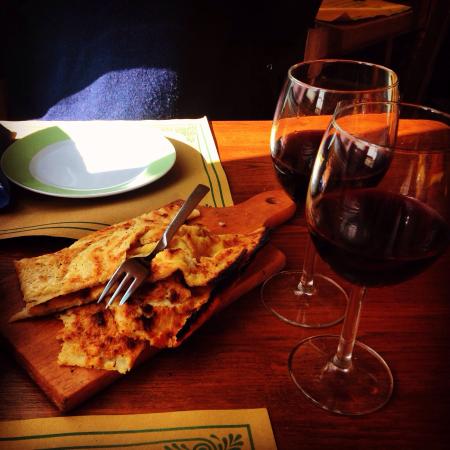
At what (x,y) coordinates should I click in order to perform the action: click on white and light green dinner plate. Please return your answer as a coordinate pair (x, y). This screenshot has width=450, height=450. Looking at the image, I should click on (77, 183).